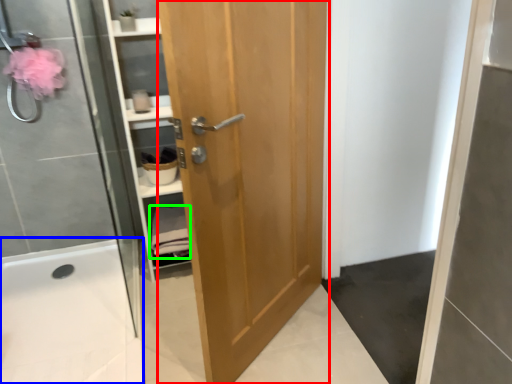
Question: Which is farther away from door (highlighted by a red box)? bath (highlighted by a blue box) or material (highlighted by a green box)?

Choices:
 (A) bath
 (B) material

Answer: (A)